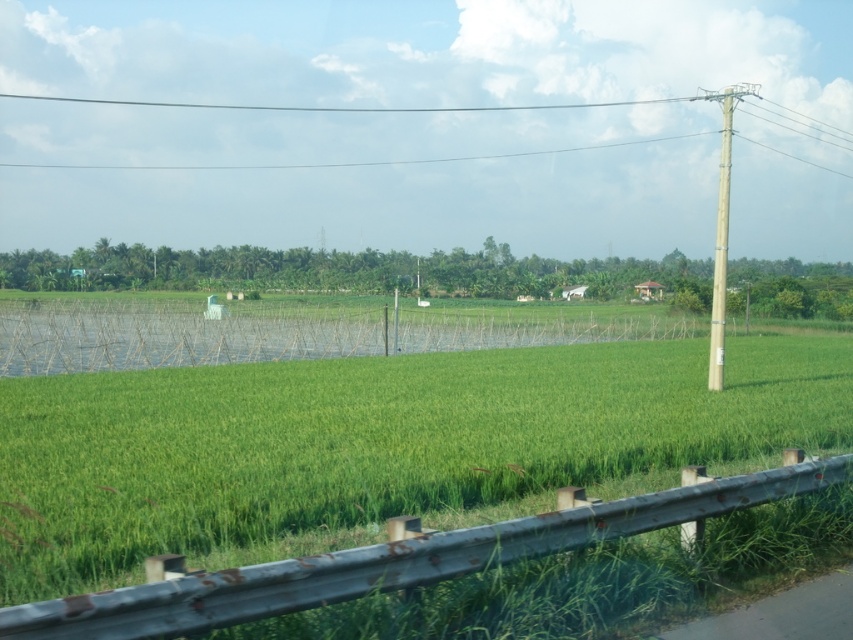
Question: Is green grass at center smaller than smooth wire power line at upper center?

Choices:
 (A) no
 (B) yes

Answer: (B)

Question: Does green grass at center have a smaller size compared to smooth wire power line at upper center?

Choices:
 (A) yes
 (B) no

Answer: (A)

Question: Which of the following is the closest to the observer?

Choices:
 (A) green grass at center
 (B) smooth wire power line at upper center

Answer: (A)

Question: Which point is farther to the camera?

Choices:
 (A) (134, 164)
 (B) (273, 371)

Answer: (A)

Question: Can you confirm if green grass at center is wider than smooth wire power line at upper center?

Choices:
 (A) yes
 (B) no

Answer: (B)

Question: Which object appears closest to the camera in this image?

Choices:
 (A) green grass at center
 (B) smooth wire power line at upper center

Answer: (A)